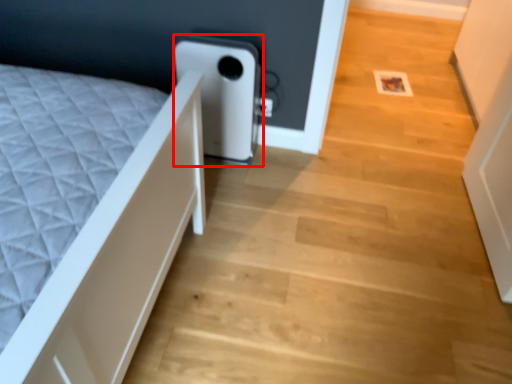
Question: In this image, where is water heater (annotated by the red box) located relative to stairwell?

Choices:
 (A) right
 (B) left

Answer: (B)